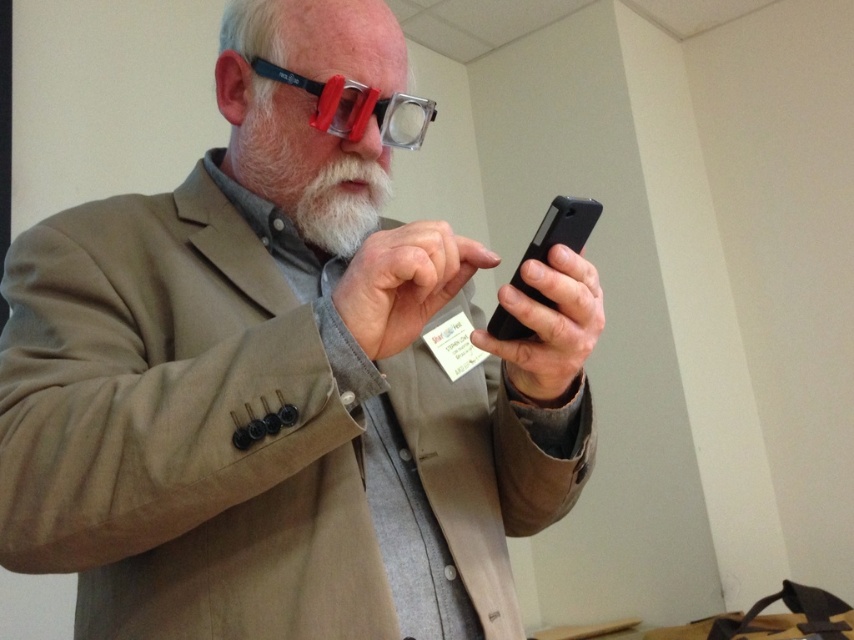
Which is more to the right, matte black phone at center or transparent plastic goggles at upper center?

matte black phone at center is more to the right.

Is matte black phone at center smaller than transparent plastic goggles at upper center?

Actually, matte black phone at center might be larger than transparent plastic goggles at upper center.

Between point (202, 456) and point (401, 109), which one is positioned behind?

Positioned behind is point (401, 109).

Identify the location of matte black phone at center. (281, 381).

What are the coordinates of `transparent plastic goggles at upper center` in the screenshot? It's located at (357, 108).

Identify the location of transparent plastic goggles at upper center. The width and height of the screenshot is (854, 640). (357, 108).

Who is shorter, black matte smartphone at center or white matte paper at center?

white matte paper at center

You are a GUI agent. You are given a task and a screenshot of the screen. Output one action in this format:
    pyautogui.click(x=<x>, y=<y>)
    Task: Click on the black matte smartphone at center
    The image size is (854, 640).
    Given the screenshot: What is the action you would take?
    pos(557,237)

You are a GUI agent. You are given a task and a screenshot of the screen. Output one action in this format:
    pyautogui.click(x=<x>, y=<y>)
    Task: Click on the black matte smartphone at center
    The image size is (854, 640).
    Given the screenshot: What is the action you would take?
    pyautogui.click(x=557, y=237)